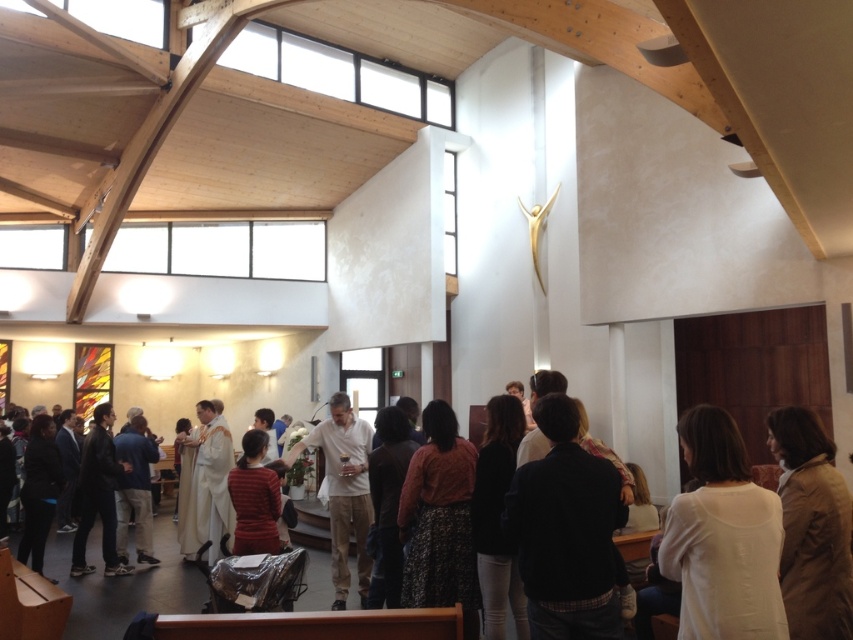
You are standing at the entrance of the church and see two points marked in the scene. Which of the two points, point (560,483) or point (370,522), is closer to you?

Point (560,483) is in front of point (370,522), so it is closer to you.

You are standing at the entrance of the church and see the light beige cotton shirt at center and the white clothed person at lower left. Which of these two individuals is positioned closer to the altar area?

The light beige cotton shirt at center is located above the white clothed person at lower left, meaning the white clothed person at lower left is closer to the altar area since they are positioned lower in the image.

You are a photographer taking pictures of the congregation during the service. You notice two people in the front row wearing a white matte shirt at center and a light beige cotton shirt at center. Which of these two shirts is smaller in size?

The white matte shirt at center is smaller than the light beige cotton shirt at center, so the white matte shirt at center is the smaller one.